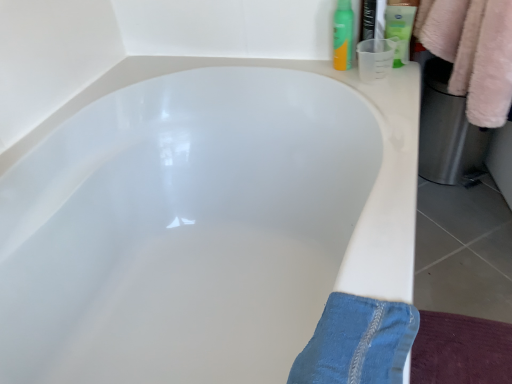
Locate an element on the screen. The image size is (512, 384). vacant space to the left of green matte lotion at upper right, acting as the second toiletry starting from the left is located at coordinates (336, 71).